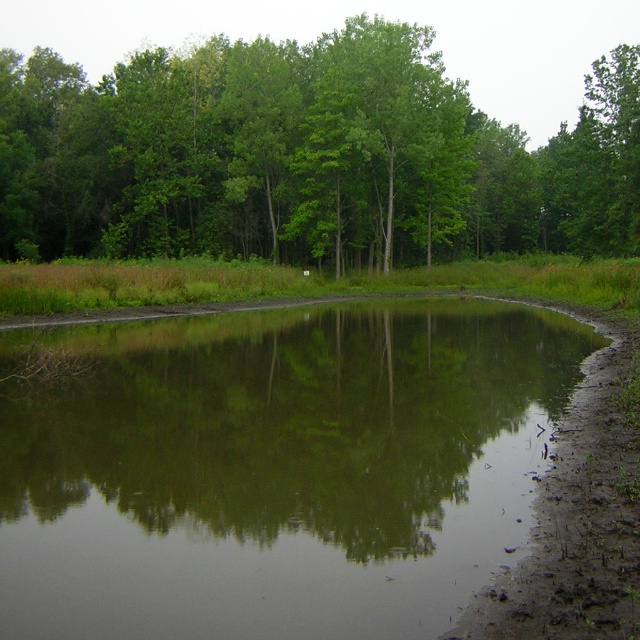
Between green reflective mud at center and green leafy trees at upper center, which one has less height?

green reflective mud at center

Between green reflective mud at center and green leafy trees at upper center, which one is positioned lower?

green reflective mud at center

What are the coordinates of `green reflective mud at center` in the screenshot? It's located at (275, 468).

Where is `green reflective mud at center`? green reflective mud at center is located at coordinates (275, 468).